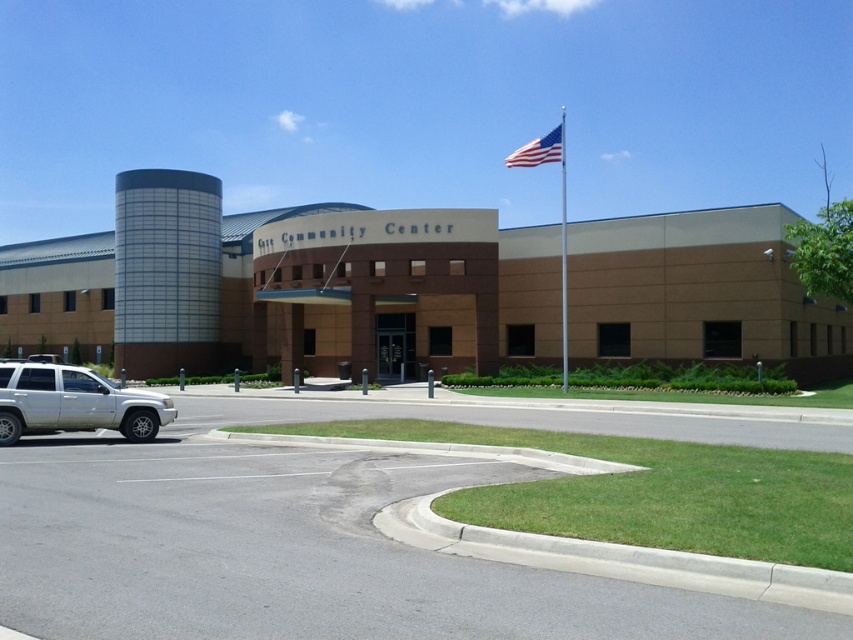
You are a visitor approaching the community center entrance. You see a silver metallic suv at lower left and an american flag at upper right. Which object appears narrower from your perspective?

The silver metallic suv at lower left appears narrower than the american flag at upper right.